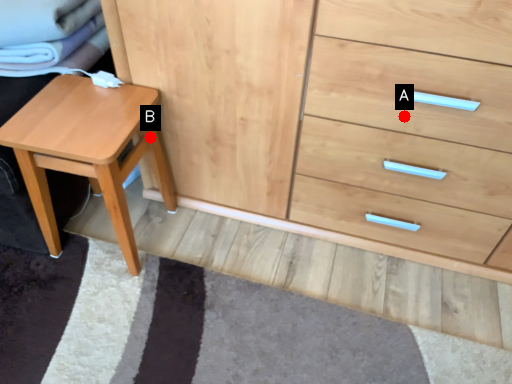
Question: Two points are circled on the image, labeled by A and B beside each circle. Which point is farther from the camera taking this photo?

Choices:
 (A) A is further
 (B) B is further

Answer: (B)